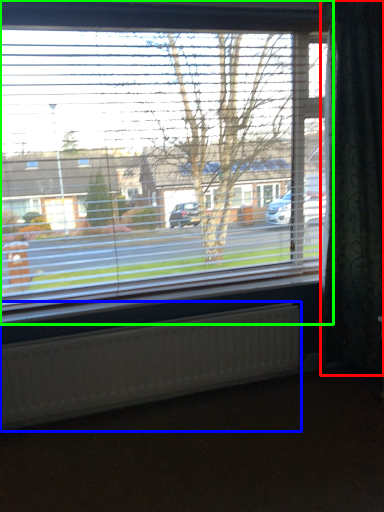
Question: Estimate the real-world distances between objects in this image. Which object is closer to curtain (highlighted by a red box), radiator (highlighted by a blue box) or window (highlighted by a green box)?

Choices:
 (A) radiator
 (B) window

Answer: (B)